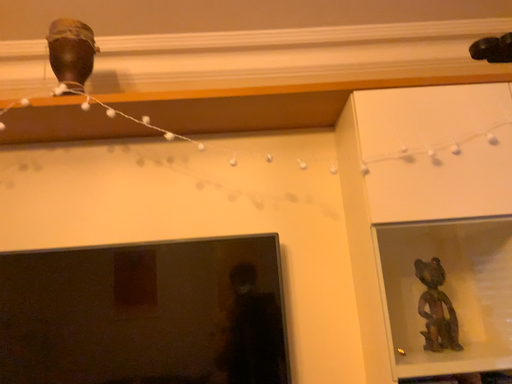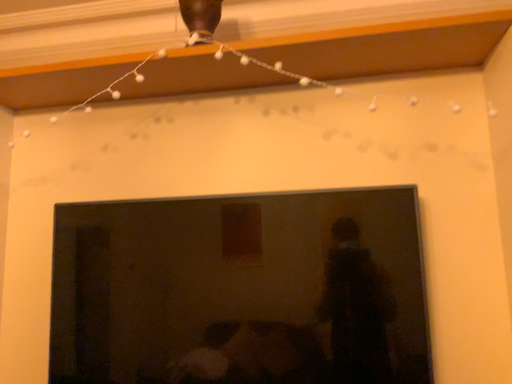
Question: Which way did the camera rotate in the video?

Choices:
 (A) rotated right
 (B) rotated left

Answer: (B)